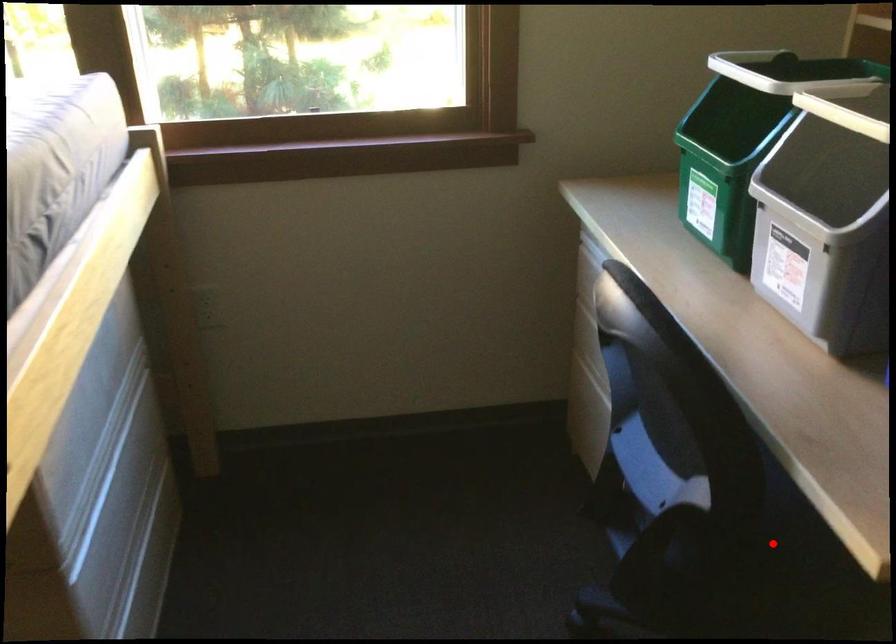
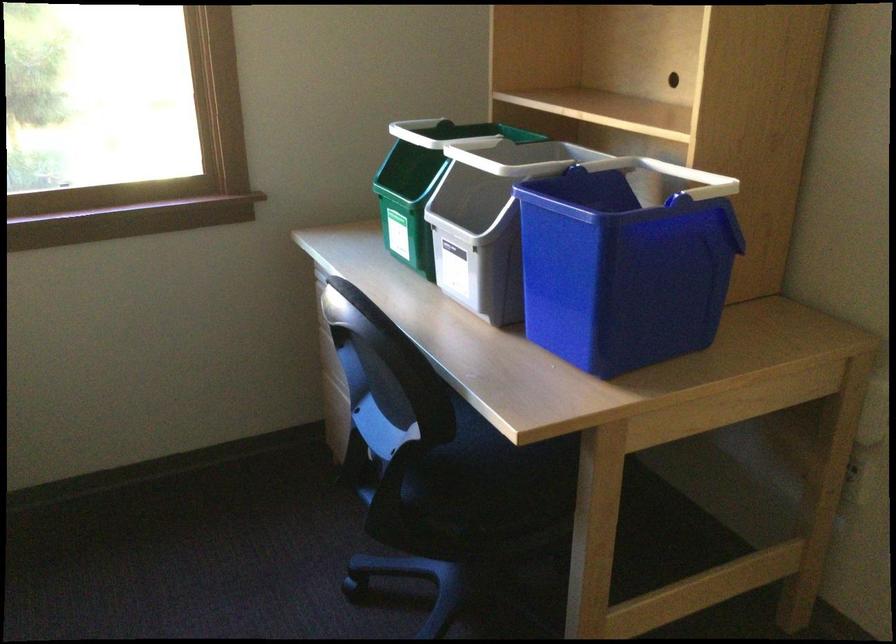
Question: I am providing you with two images of the same scene from different viewpoints. A red point is marked on the first image. At the location where the point appears in image 1, is it still visible in image 2?

Choices:
 (A) Yes
 (B) No

Answer: (A)